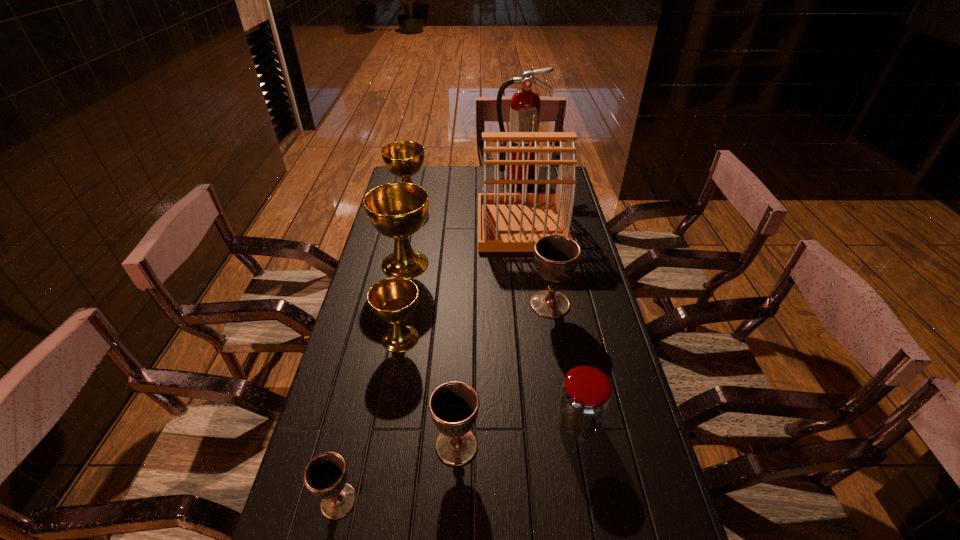
At what (x,y) coordinates should I click in order to perform the action: click on free area in between the farthest gold chalice and the red fire extinguisher. Please return your answer as a coordinate pair (x, y). Looking at the image, I should click on (465, 188).

Identify the location of vacant space in between the nearest gold chalice and the fire extinguisher. The height and width of the screenshot is (540, 960). (460, 258).

You are a GUI agent. You are given a task and a screenshot of the screen. Output one action in this format:
    pyautogui.click(x=<x>, y=<y>)
    Task: Click on the vacant point located between the fifth farthest object and the fourth nearest object
    
    Given the screenshot: What is the action you would take?
    pyautogui.click(x=475, y=321)

This screenshot has height=540, width=960. I want to click on free space between the second brown chalice from right to left and the jar, so click(x=517, y=435).

Locate an element on the screen. The height and width of the screenshot is (540, 960). vacant space that's between the fourth nearest object and the nearest object is located at coordinates (370, 420).

Identify the location of empty space that is in between the seventh shortest object and the second brown chalice from left to right. This screenshot has width=960, height=540. (431, 355).

The height and width of the screenshot is (540, 960). Identify the location of free space between the beige birdcage and the fifth nearest chalice. (464, 245).

You are a GUI agent. You are given a task and a screenshot of the screen. Output one action in this format:
    pyautogui.click(x=<x>, y=<y>)
    Task: Click on the object that stands as the sixth closest to the red jar
    This screenshot has width=960, height=540.
    Given the screenshot: What is the action you would take?
    pyautogui.click(x=507, y=222)

Identify which object is the sixth closest to the farthest brown chalice. Please provide its 2D coordinates. Your answer should be formatted as a tuple, i.e. [(x, y)], where the tuple contains the x and y coordinates of a point satisfying the conditions above.

[(404, 159)]

Where is `chalice that is the third closest to the leftmost brown chalice`? Image resolution: width=960 pixels, height=540 pixels. chalice that is the third closest to the leftmost brown chalice is located at coordinates (556, 257).